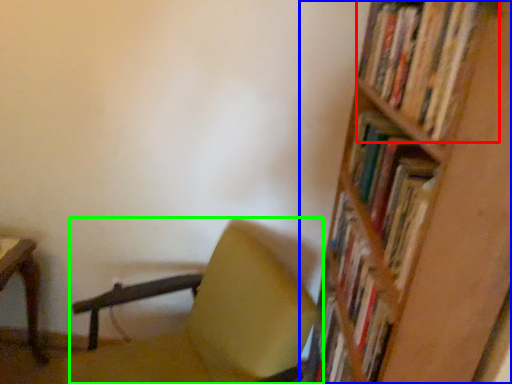
Question: Which object is positioned farthest from book (highlighted by a red box)? Select from shelf (highlighted by a blue box) and chair (highlighted by a green box).

Choices:
 (A) shelf
 (B) chair

Answer: (B)